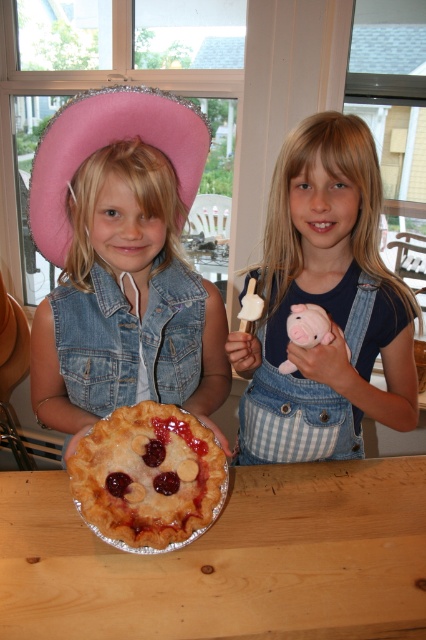
Consider the image. Is denim overalls at center in front of pink fabric straw hat at upper left?

No, denim overalls at center is further to the viewer.

How far apart are denim overalls at center and pink fabric straw hat at upper left?

11.63 inches

Image resolution: width=426 pixels, height=640 pixels. What are the coordinates of `denim overalls at center` in the screenshot? It's located at (325, 305).

Between golden flaky pie at center and pink fabric straw hat at upper left, which one has less height?

Standing shorter between the two is golden flaky pie at center.

Does golden flaky pie at center have a lesser width compared to pink fabric straw hat at upper left?

Yes, golden flaky pie at center is thinner than pink fabric straw hat at upper left.

Is point (161, 508) less distant than point (129, 96)?

Yes, point (161, 508) is in front of point (129, 96).

The image size is (426, 640). I want to click on golden flaky pie at center, so click(147, 477).

Is denim overalls at center thinner than golden flaky pie at center?

Incorrect, denim overalls at center's width is not less than golden flaky pie at center's.

Which is in front, point (284, 323) or point (112, 413)?

Point (112, 413)

This screenshot has height=640, width=426. Identify the location of denim overalls at center. (325, 305).

You are a GUI agent. You are given a task and a screenshot of the screen. Output one action in this format:
    pyautogui.click(x=<x>, y=<y>)
    Task: Click on the denim overalls at center
    Image resolution: width=426 pixels, height=640 pixels.
    Given the screenshot: What is the action you would take?
    pyautogui.click(x=325, y=305)